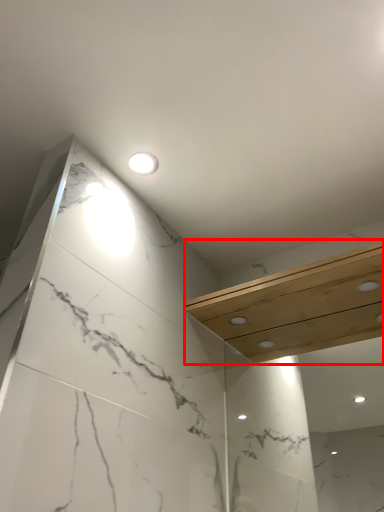
Question: In this image, where is balustrade (annotated by the red box) located relative to light fixture?

Choices:
 (A) left
 (B) right

Answer: (B)